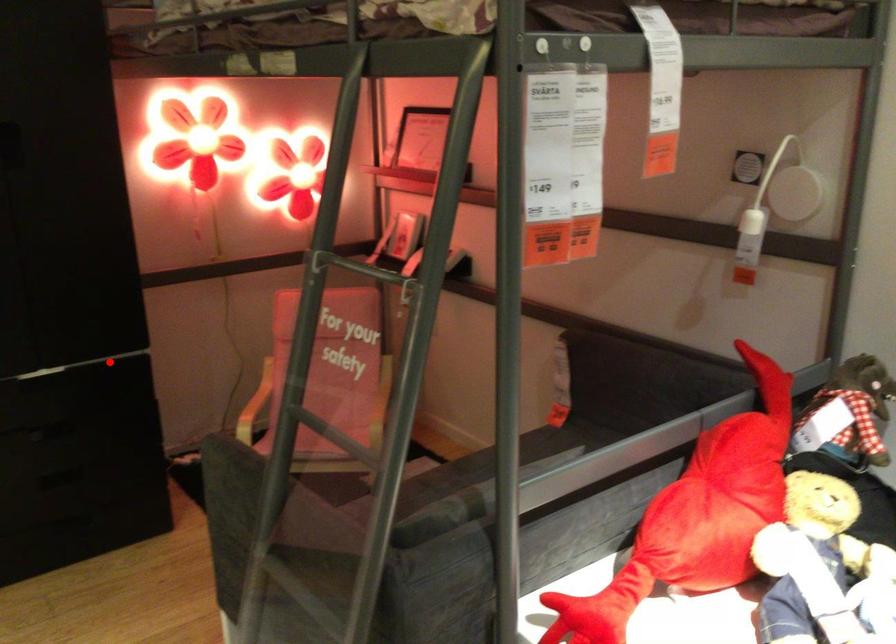
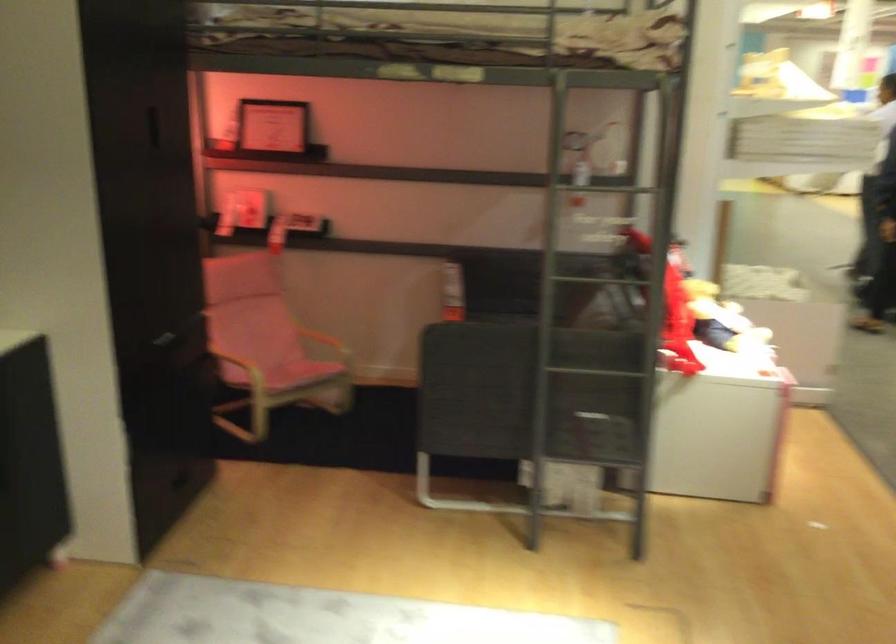
Question: A red point is marked in image1. In image2, is the corresponding 3D point closer to the camera or farther? Reply with the corresponding letter.

Choices:
 (A) The corresponding 3D point is closer.
 (B) The corresponding 3D point is farther.

Answer: (B)